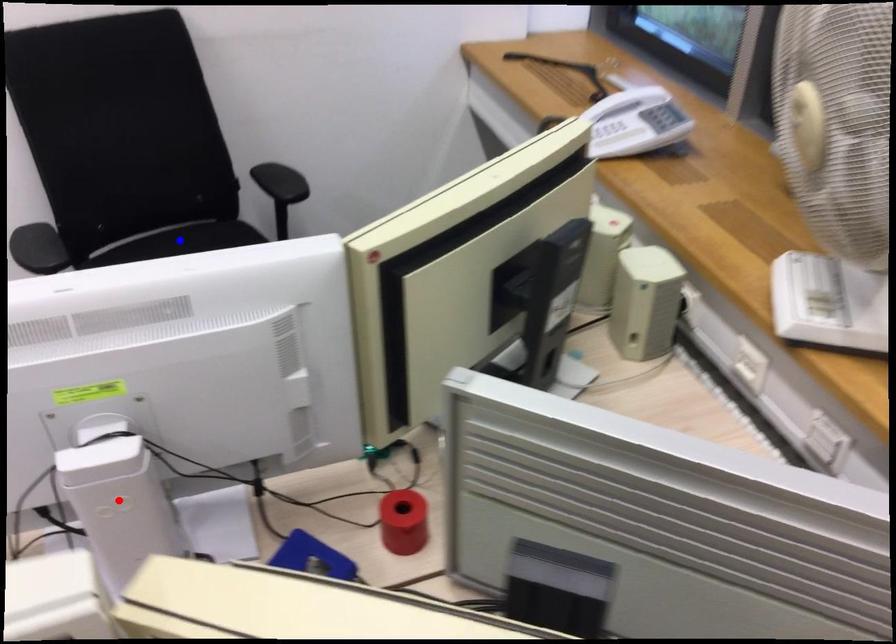
Question: Two points are marked on the image. Which point is closer to the camera?

Choices:
 (A) Blue point is closer.
 (B) Red point is closer.

Answer: (B)